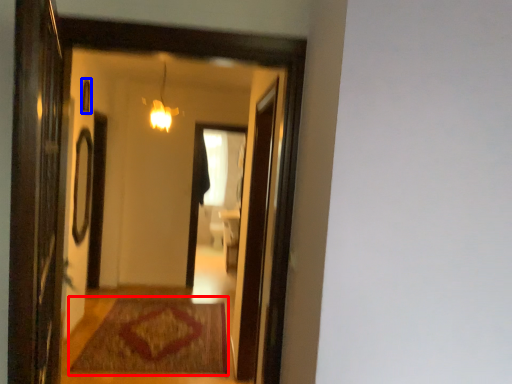
Question: Which of the following is the closest to the observer, mat (highlighted by a red box) or window (highlighted by a blue box)?

Choices:
 (A) mat
 (B) window

Answer: (A)